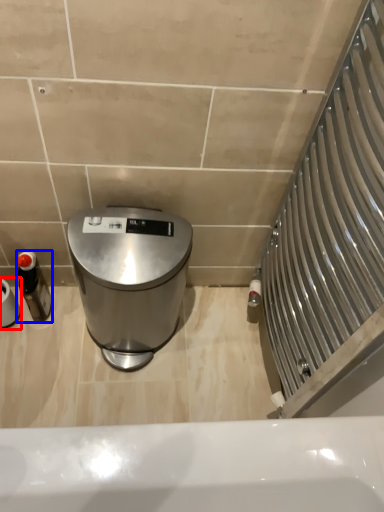
Question: Which object appears farthest to the camera in this image, toilet paper (highlighted by a red box) or bottle (highlighted by a blue box)?

Choices:
 (A) toilet paper
 (B) bottle

Answer: (B)